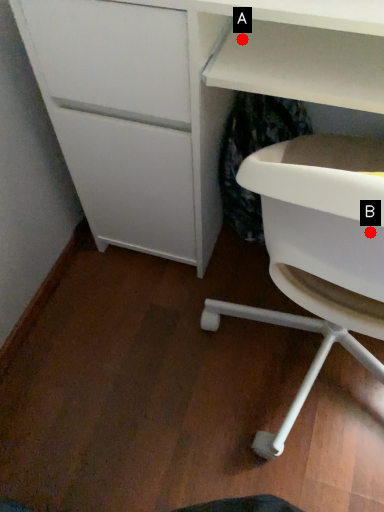
Question: Two points are circled on the image, labeled by A and B beside each circle. Which of the following is the farthest from the observer?

Choices:
 (A) A is further
 (B) B is further

Answer: (A)